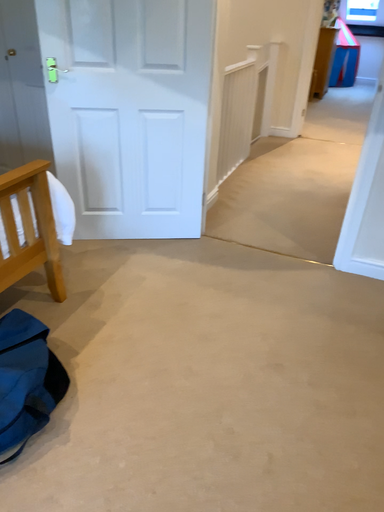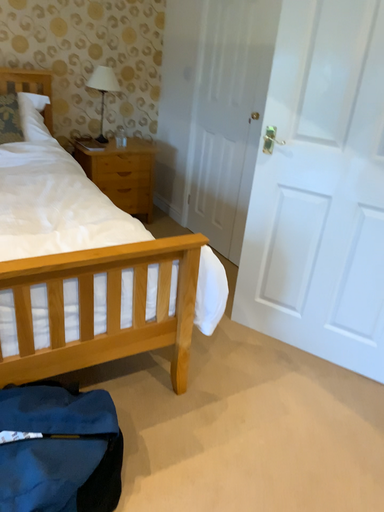
Question: Which way did the camera rotate in the video?

Choices:
 (A) rotated downward
 (B) rotated upward

Answer: (B)